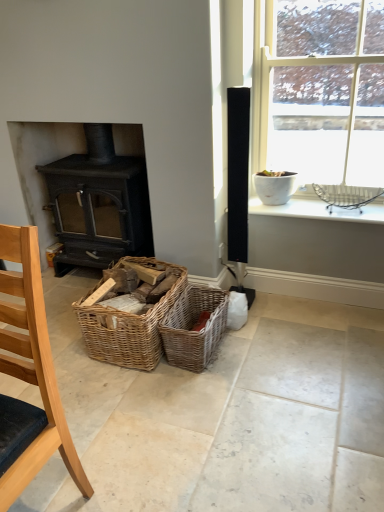
Question: Is white ceramic bowl at upper right in front of or behind light wood chair at lower left in the image?

Choices:
 (A) front
 (B) behind

Answer: (B)

Question: Is white ceramic bowl at upper right situated inside light wood chair at lower left or outside?

Choices:
 (A) outside
 (B) inside

Answer: (A)

Question: Which object is the farthest from the matte black wood burning stove at left?

Choices:
 (A) woven brown picnic basket at center, the first picnic basket from the right
 (B) white ceramic bowl at upper right
 (C) woven wood baskets at center, marked as the 2th picnic basket in a right-to-left arrangement
 (D) metallic wire basket at upper right
 (E) white glossy pot at upper right

Answer: (D)

Question: Considering the real-world distances, which object is closest to the white glossy pot at upper right?

Choices:
 (A) matte black wood burning stove at left
 (B) woven wood baskets at center, which ranks as the 1th picnic basket in left-to-right order
 (C) metallic wire basket at upper right
 (D) woven brown picnic basket at center, the first picnic basket from the right
 (E) light wood chair at lower left

Answer: (C)